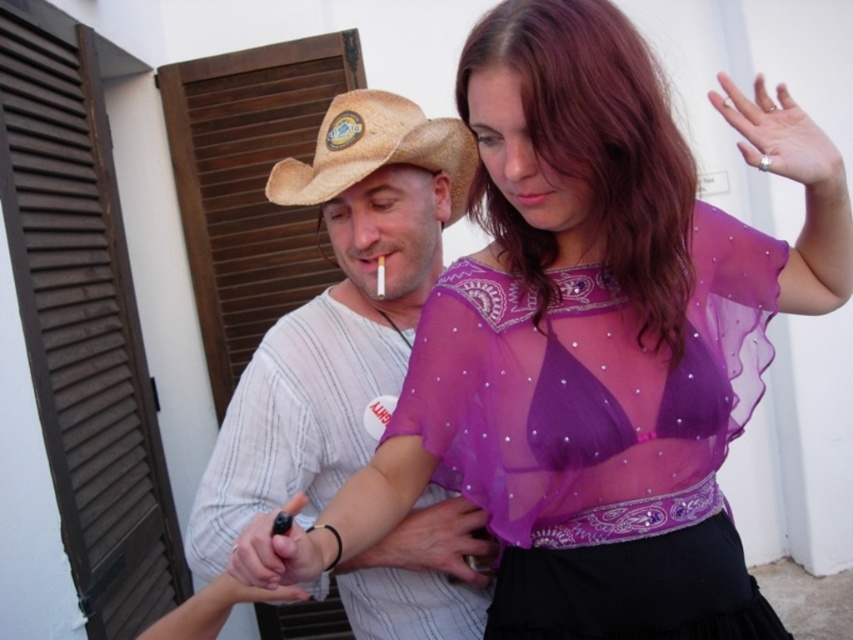
Question: Is brown wooden shutter at left positioned in front of strawhat at center?

Choices:
 (A) yes
 (B) no

Answer: (B)

Question: Which object appears closest to the camera in this image?

Choices:
 (A) brown wooden shutter at left
 (B) strawhat at center

Answer: (B)

Question: Which object is closer to the camera taking this photo?

Choices:
 (A) strawhat at center
 (B) straw hat at center
 (C) brown wooden shutter at left
 (D) sheer purple fabric dress at center

Answer: (D)

Question: Is sheer purple fabric dress at center bigger than straw hat at center?

Choices:
 (A) no
 (B) yes

Answer: (A)

Question: Which point is farther to the camera?

Choices:
 (A) brown wooden shutter at left
 (B) straw hat at center
 (C) strawhat at center
 (D) sheer purple fabric dress at center

Answer: (A)

Question: Can you confirm if sheer purple fabric dress at center is wider than strawhat at center?

Choices:
 (A) no
 (B) yes

Answer: (B)